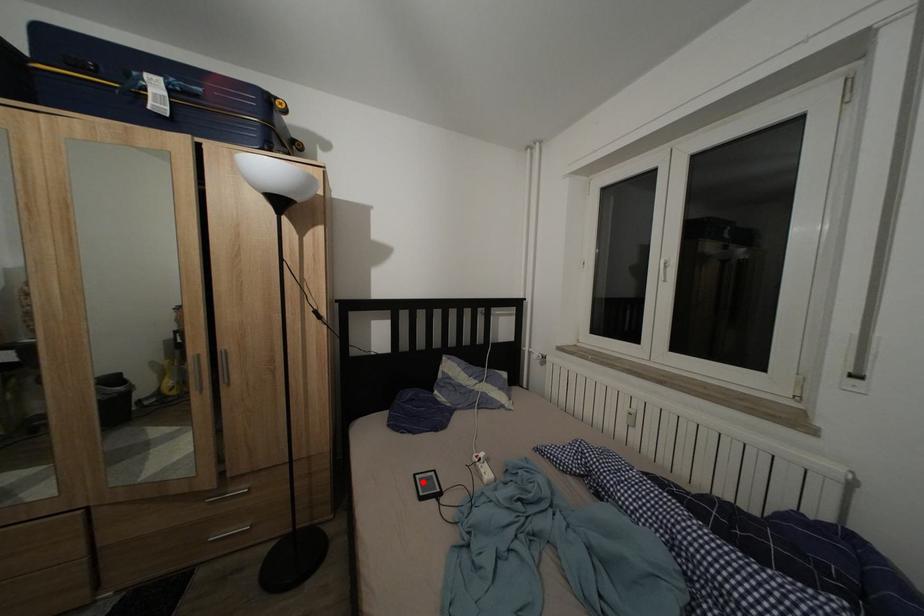
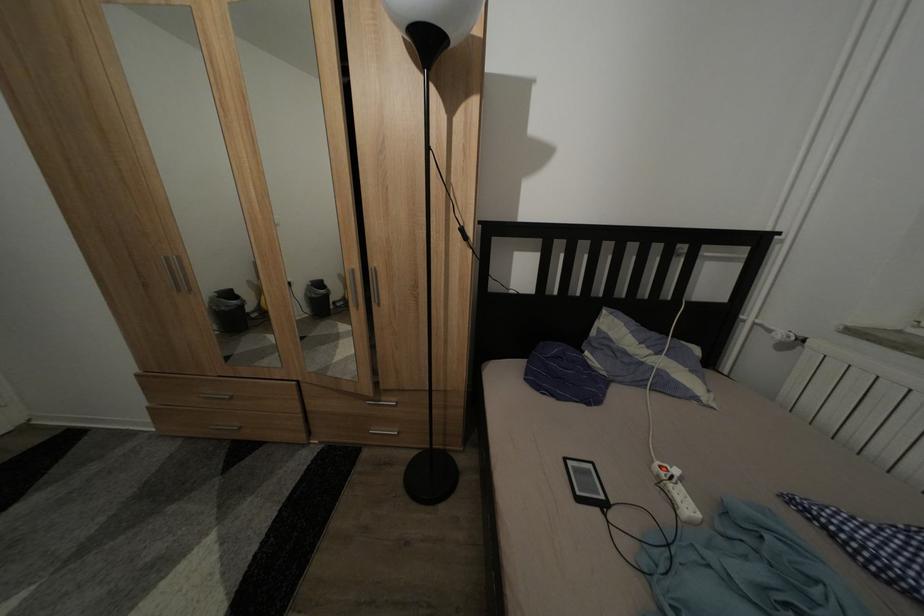
Find the pixel in the second image that matches the highlighted location in the first image.

(573, 466)